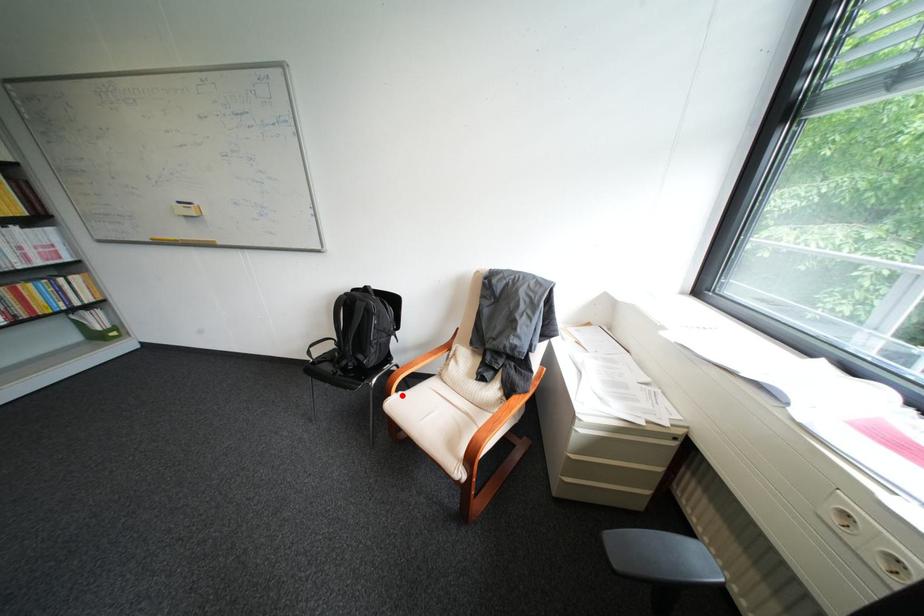
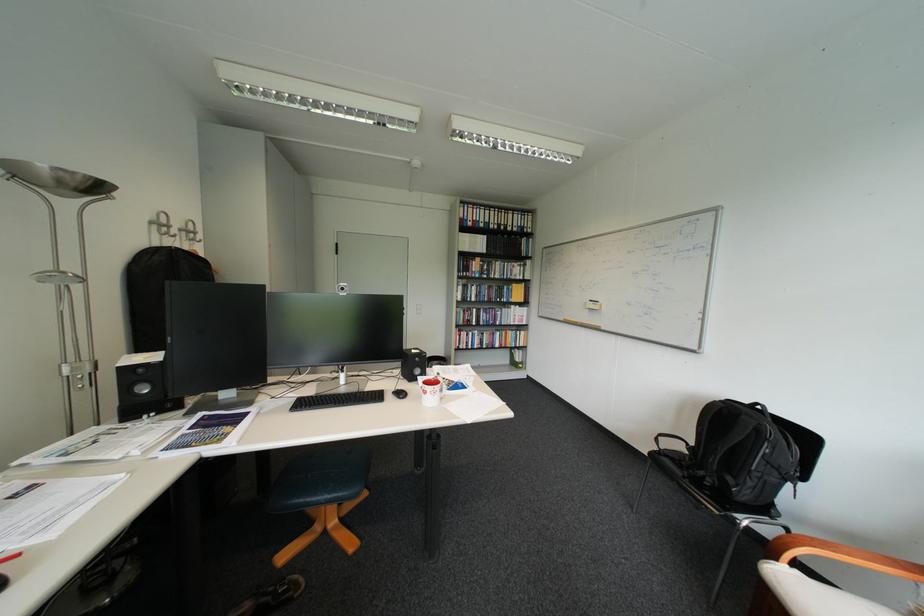
Question: A red point is marked in image1. In image2, is the corresponding 3D point closer to the camera or farther? Reply with the corresponding letter.

Choices:
 (A) The corresponding 3D point is closer.
 (B) The corresponding 3D point is farther.

Answer: (A)